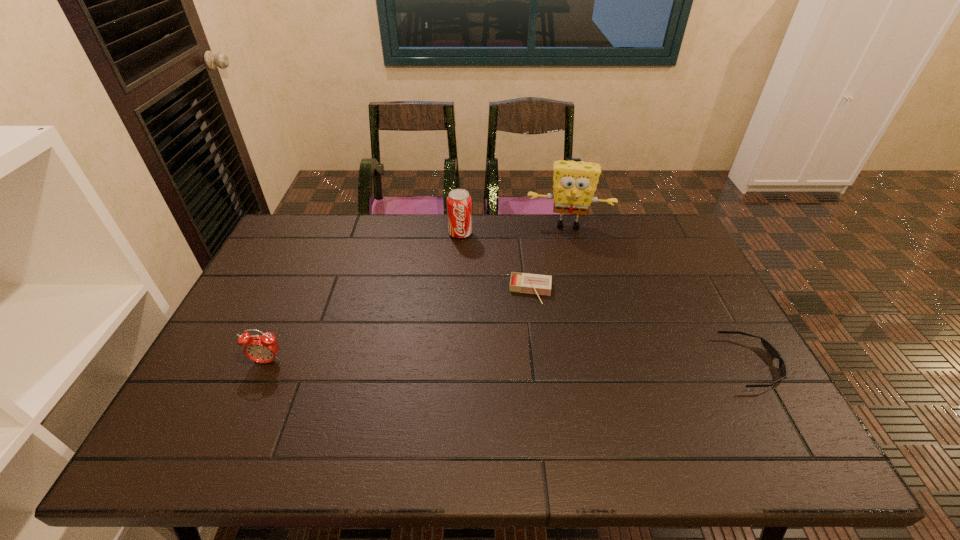
Identify the location of sponge located at the far edge. This screenshot has height=540, width=960. (574, 185).

Locate an element on the screen. object that is positioned at the near edge is located at coordinates (772, 351).

Locate an element on the screen. The height and width of the screenshot is (540, 960). object situated at the left edge is located at coordinates (263, 348).

Where is `object situated at the right edge`? object situated at the right edge is located at coordinates (772, 351).

Locate an element on the screen. The width and height of the screenshot is (960, 540). object present at the near right corner is located at coordinates (772, 351).

In the image, there is a desktop. Identify the location of vacant space at the far edge. (421, 215).

Where is `free space at the near edge of the desktop`? This screenshot has width=960, height=540. free space at the near edge of the desktop is located at coordinates (449, 406).

Where is `free space at the left edge of the desktop`? free space at the left edge of the desktop is located at coordinates (203, 385).

Where is `vacant region at the far right corner`? This screenshot has width=960, height=540. vacant region at the far right corner is located at coordinates (666, 249).

The height and width of the screenshot is (540, 960). In order to click on empty space between the tallest object and the fourth tallest object in this screenshot , I will do `click(549, 258)`.